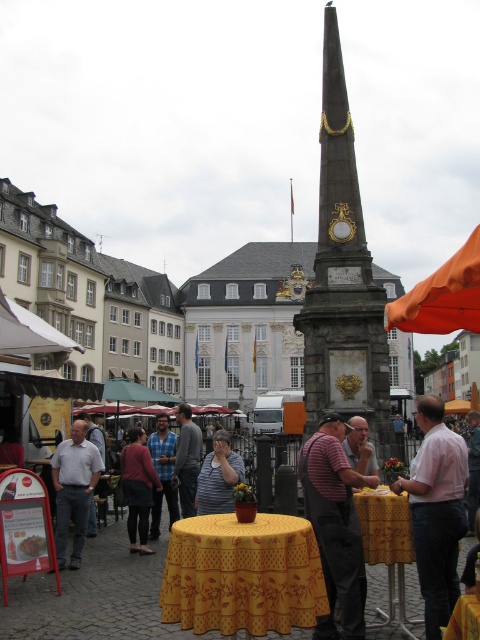
You are an observer standing in the town square and notice two people dressed in the pink fabric shirt at center and the gray sweater at center. Which clothing item is taller?

The pink fabric shirt at center is taller than the gray sweater at center.

You are a photographer standing in the town square and want to capture both the light gray shirt at center and the striped shirt at center in a single photo. Which person should you position closer to the camera to ensure both are fully visible?

You should position the striped shirt at center closer to the camera because the light gray shirt at center is much taller, so bringing the shorter striped shirt at center forward will help balance their sizes in the photo.